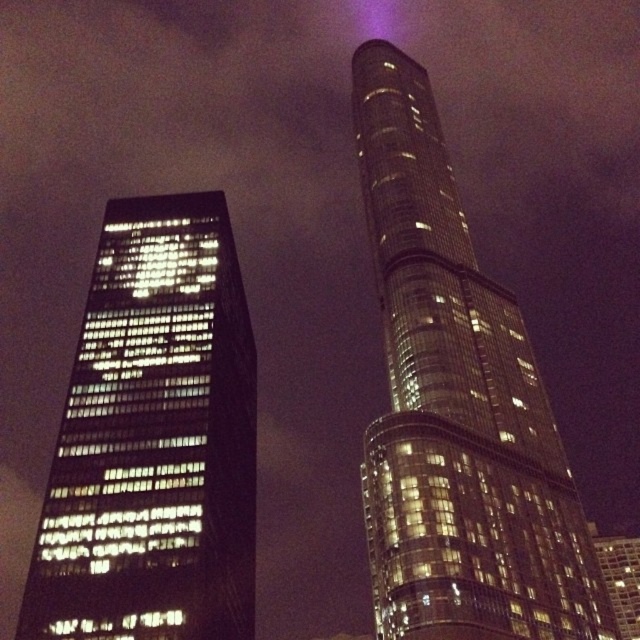
Question: Can you confirm if glossy glass tower at upper center is positioned above black glass building at left?

Choices:
 (A) no
 (B) yes

Answer: (B)

Question: Can you confirm if glossy glass tower at upper center is bigger than black glass building at left?

Choices:
 (A) no
 (B) yes

Answer: (B)

Question: Can you confirm if glossy glass tower at upper center is positioned to the right of black glass building at left?

Choices:
 (A) no
 (B) yes

Answer: (B)

Question: Which of the following is the farthest from the observer?

Choices:
 (A) glossy glass tower at upper center
 (B) black glass building at left

Answer: (B)